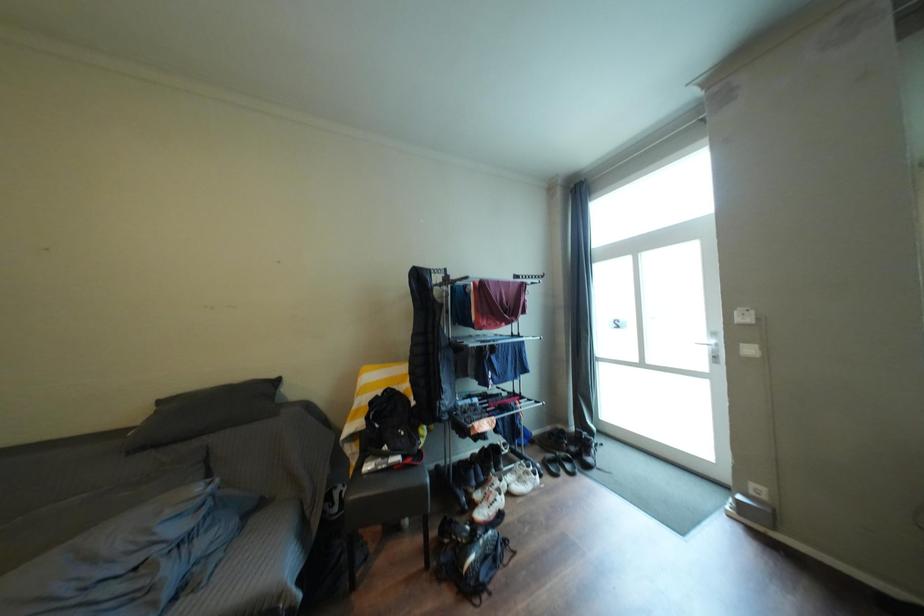
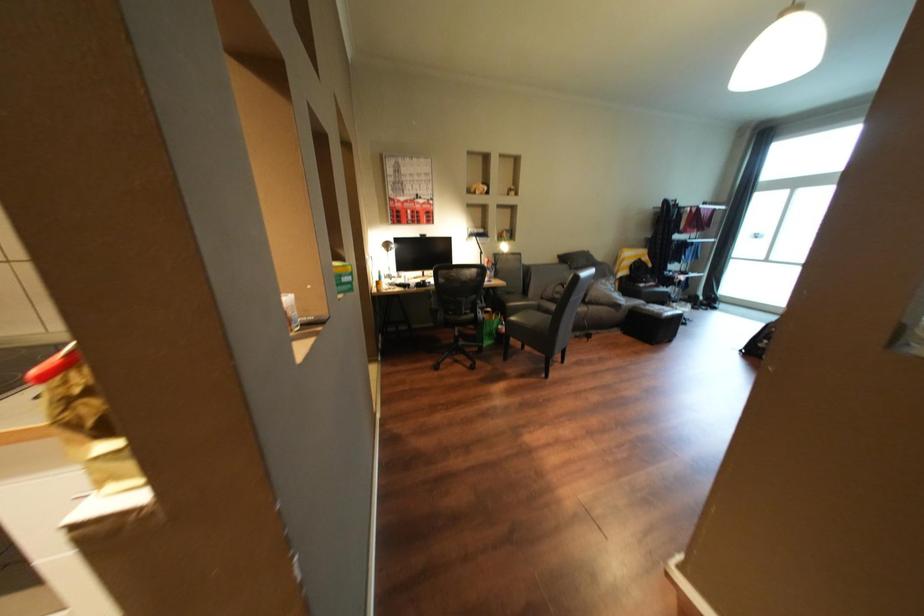
The images are taken continuously from a first-person perspective. In which direction are you moving?

The movement direction of the cameraman is left, backward.